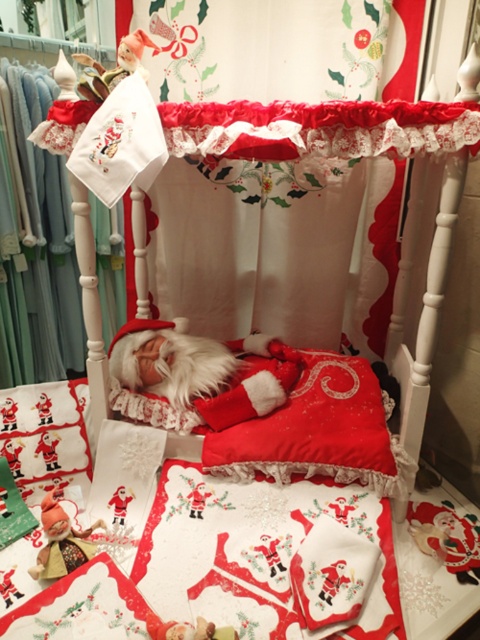
You are organizing a holiday display and need to arrange the matte red elf at lower left and the matte plastic doll at upper left on a shelf. The shelf has a height limit of 12 inches. If the plastic doll is 14 inches tall, will both items fit on the shelf?

The matte plastic doll at upper left is 14 inches tall, exceeding the shelf height limit of 12 inches. Therefore, neither the matte red elf at lower left nor the matte plastic doll at upper left can be placed on the shelf.